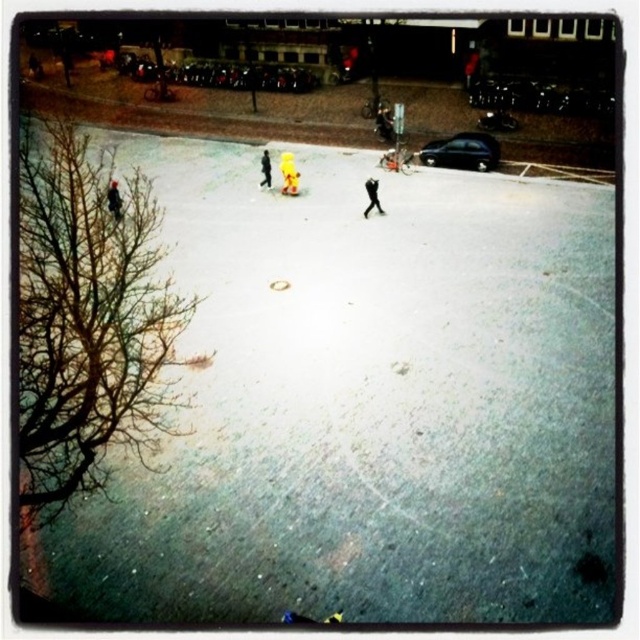
You are standing at the origin point of the coordinate system in this scene. The black matte figure at center is at coordinates 0.308, 0.581. Can you determine if this figure is closer to the top or bottom of the image?

The black matte figure at center is located at point (371, 196). In a coordinate system where the origin is at the bottom left, the y coordinate determines vertical position. Since 0.581 is closer to 1 than to 0, the figure is closer to the bottom of the image.

You are a drone operator trying to locate a specific individual in an icy urban area at night. Your task is to identify the exact coordinates of the yellow matte person at center. What are their coordinates?

The yellow matte person at center is located at coordinates point (289, 173).

You are a delivery drone with a 1.5 meter wingspan. You need to fly between the black matte figure at center and the dark gray jacket at left to deliver a package. Can you safely navigate the space between them without hitting either?

The distance between the black matte figure at center and the dark gray jacket at left is 9.43 meters. Since your drone has a wingspan of 1.5 meters, there is sufficient space to safely navigate between them without any collisions.